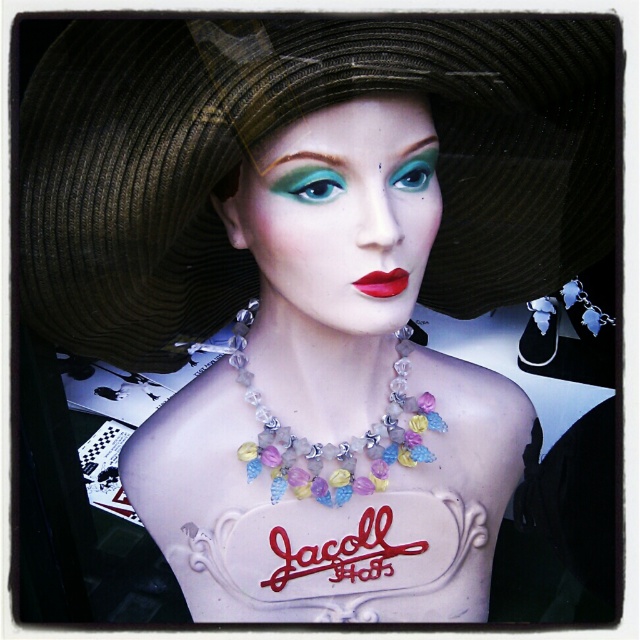
Question: Can you confirm if matte teal eye at center is positioned to the left of teal matte eye at center?

Choices:
 (A) yes
 (B) no

Answer: (A)

Question: Among these points, which one is farthest from the camera?

Choices:
 (A) click(372, 273)
 (B) click(461, 150)
 (C) click(476, 506)
 (D) click(326, 173)

Answer: (C)

Question: Can you confirm if pastel crystal necklace at center is bigger than matte teal eye at center?

Choices:
 (A) no
 (B) yes

Answer: (B)

Question: Which point is closer to the camera?

Choices:
 (A) (480, 552)
 (B) (387, 282)

Answer: (B)

Question: Is matte black hat at upper center below teal matte eye at center?

Choices:
 (A) yes
 (B) no

Answer: (A)

Question: Which object appears closest to the camera in this image?

Choices:
 (A) pastel crystal necklace at center
 (B) teal matte eye at center

Answer: (B)